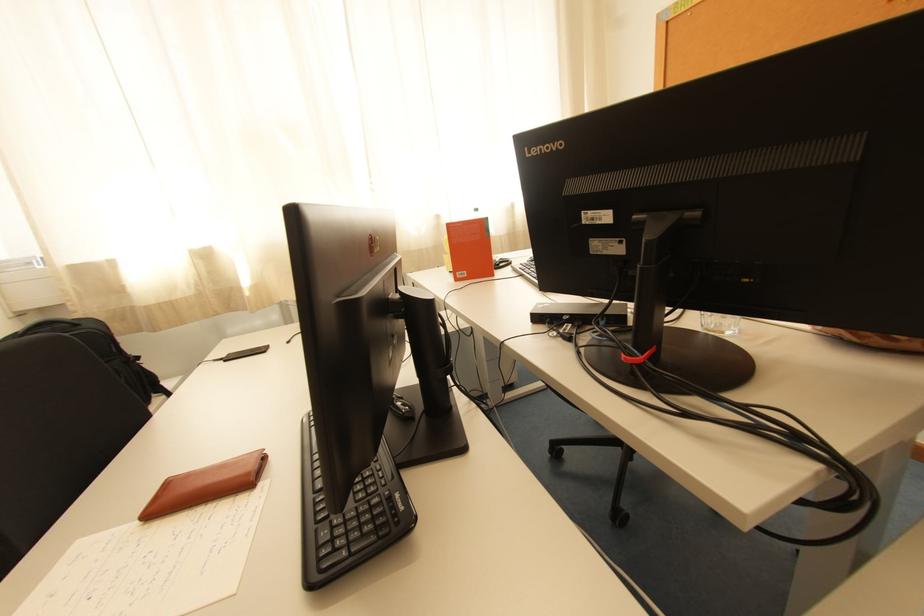
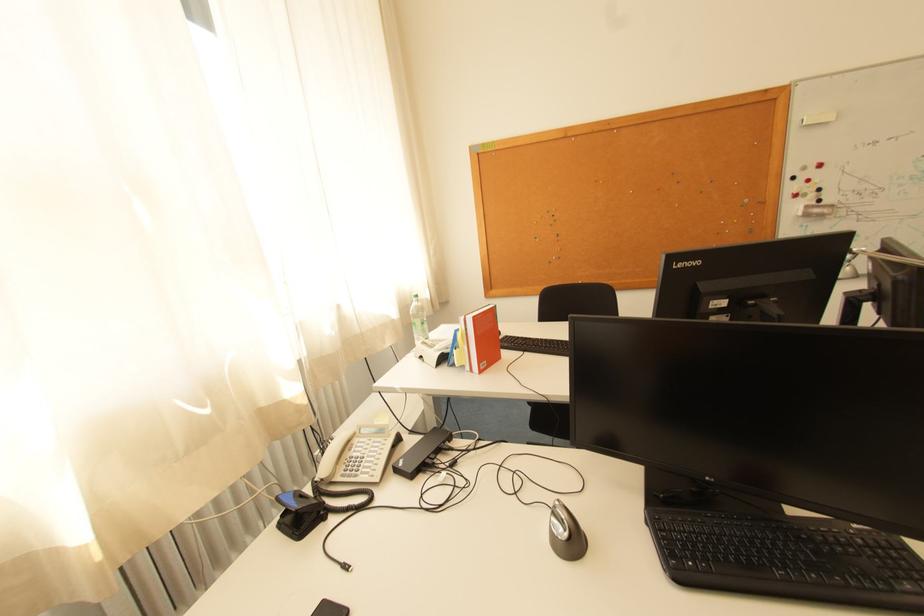
The point at (473, 274) is marked in the first image. Where is the corresponding point in the second image?

(493, 363)